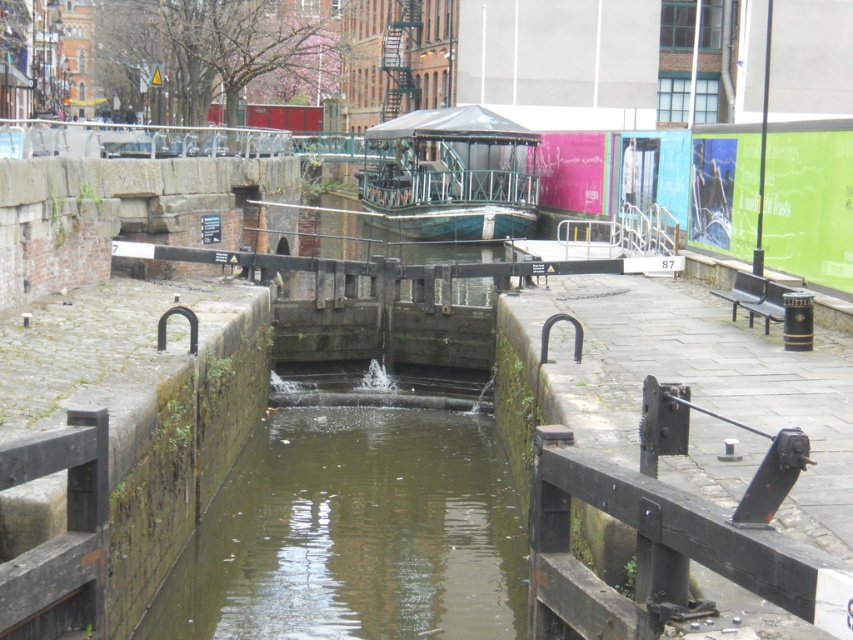
Who is more forward, (413, 572) or (489, 145)?

Point (413, 572) is more forward.

Does point (262, 621) come behind point (518, 221)?

No, it is not.

Who is more forward, (x=463, y=416) or (x=374, y=163)?

Positioned in front is point (x=463, y=416).

Locate an element on the screen. This screenshot has width=853, height=640. greenish concrete water at center is located at coordinates (357, 518).